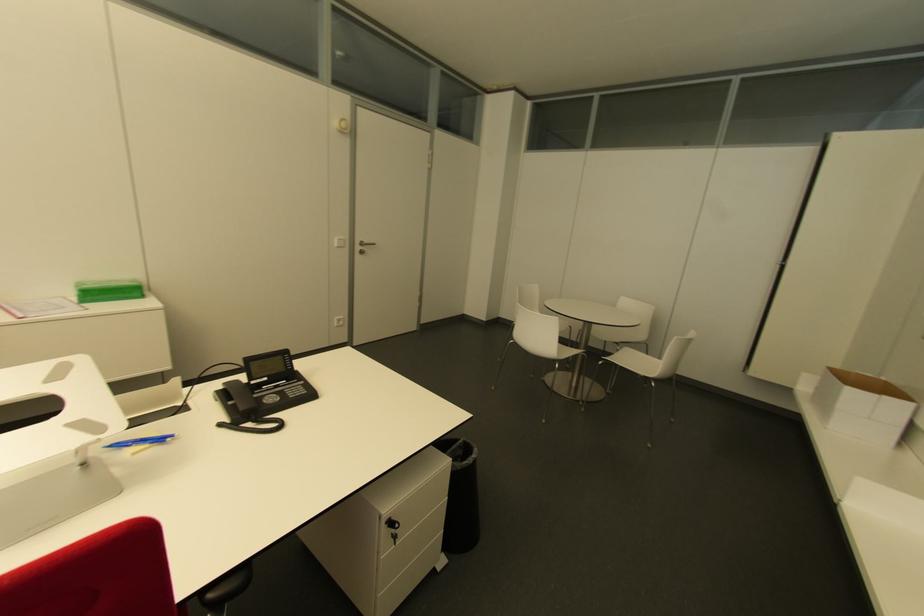
The image size is (924, 616). In order to click on telephone keypad button in this screenshot , I will do `click(294, 390)`.